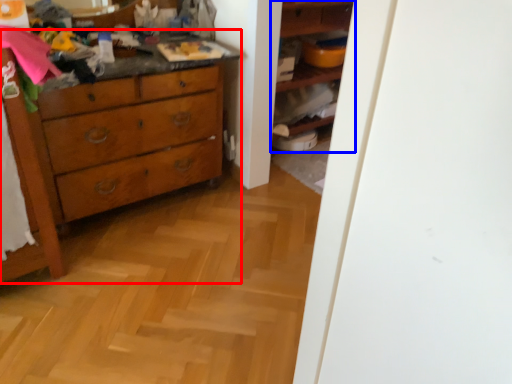
Question: Which of the following is the closest to the observer, chest of drawers (highlighted by a red box) or shelf (highlighted by a blue box)?

Choices:
 (A) chest of drawers
 (B) shelf

Answer: (A)